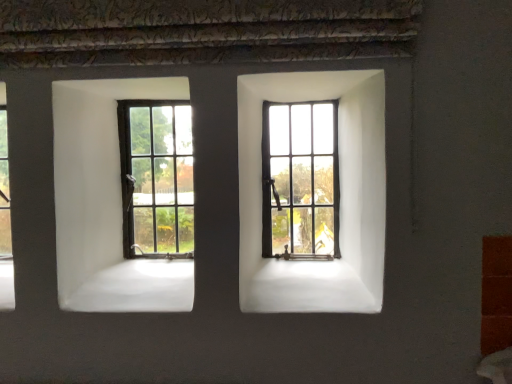
Question: Should I look upward or downward to see matte black window at center, placed as the 2th window when sorted from left to right?

Choices:
 (A) up
 (B) down

Answer: (A)

Question: Can you confirm if matte black window at center left, arranged as the 2th window when viewed from the right, is bigger than matte black window at center, placed as the 2th window when sorted from left to right?

Choices:
 (A) yes
 (B) no

Answer: (A)

Question: From the image's perspective, is matte black window at center left, arranged as the 2th window when viewed from the right, below matte black window at center, placed as the 2th window when sorted from left to right?

Choices:
 (A) yes
 (B) no

Answer: (A)

Question: Is matte black window at center, placed as the 2th window when sorted from left to right, completely or partially inside matte black window at center left, which is the first window in left-to-right order?

Choices:
 (A) yes
 (B) no

Answer: (B)

Question: Is matte black window at center left, arranged as the 2th window when viewed from the right, outside of matte black window at center, placed as the 2th window when sorted from left to right?

Choices:
 (A) no
 (B) yes

Answer: (B)

Question: From a real-world perspective, does matte black window at center left, arranged as the 2th window when viewed from the right, sit lower than matte black window at center, placed as the 2th window when sorted from left to right?

Choices:
 (A) yes
 (B) no

Answer: (B)

Question: Considering the relative sizes of matte black window at center left, which is the first window in left-to-right order, and matte black window at center, the 1th window in the right-to-left sequence, in the image provided, is matte black window at center left, which is the first window in left-to-right order, taller than matte black window at center, the 1th window in the right-to-left sequence,?

Choices:
 (A) no
 (B) yes

Answer: (B)

Question: Are matte black window at center, placed as the 2th window when sorted from left to right, and matte black window at center left, which is the first window in left-to-right order, far apart?

Choices:
 (A) no
 (B) yes

Answer: (A)

Question: Is matte black window at center left, arranged as the 2th window when viewed from the right, surrounded by matte black window at center, the 1th window in the right-to-left sequence?

Choices:
 (A) no
 (B) yes

Answer: (A)

Question: Is matte black window at center, placed as the 2th window when sorted from left to right, closer to the viewer compared to matte black window at center left, arranged as the 2th window when viewed from the right?

Choices:
 (A) yes
 (B) no

Answer: (A)

Question: Does matte black window at center, placed as the 2th window when sorted from left to right, appear on the left side of matte black window at center left, arranged as the 2th window when viewed from the right?

Choices:
 (A) yes
 (B) no

Answer: (B)

Question: Can you confirm if matte black window at center, the 1th window in the right-to-left sequence, is taller than matte black window at center left, arranged as the 2th window when viewed from the right?

Choices:
 (A) no
 (B) yes

Answer: (A)

Question: From a real-world perspective, is matte black window at center, the 1th window in the right-to-left sequence, positioned over matte black window at center left, which is the first window in left-to-right order, based on gravity?

Choices:
 (A) no
 (B) yes

Answer: (A)

Question: Is matte black window at center left, arranged as the 2th window when viewed from the right, to the left or to the right of matte black window at center, placed as the 2th window when sorted from left to right, in the image?

Choices:
 (A) right
 (B) left

Answer: (B)